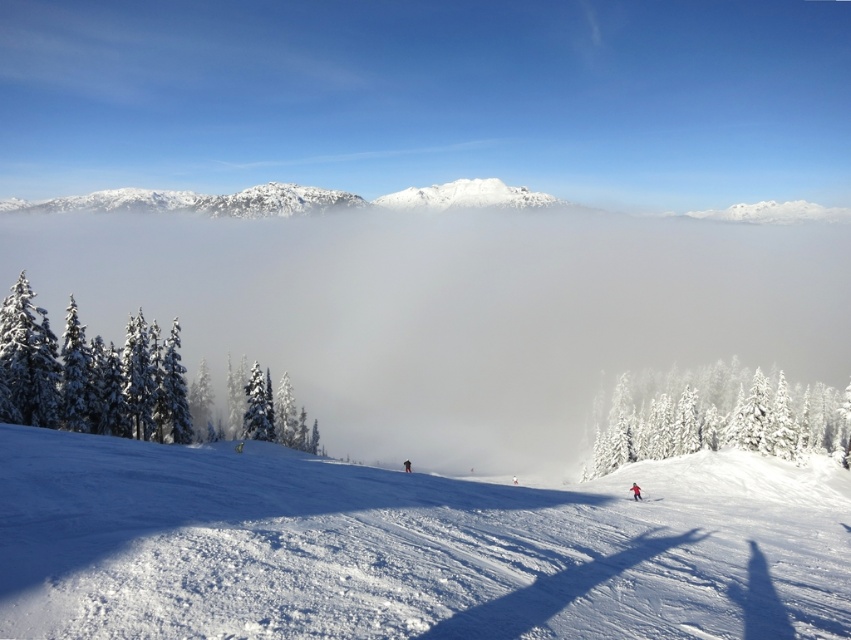
Who is more forward, (370, 228) or (660, 500)?

Point (660, 500) is more forward.

Who is shorter, white fluffy fog at center or red matte ski at lower right?

red matte ski at lower right is shorter.

What do you see at coordinates (448, 301) in the screenshot? I see `white fluffy fog at center` at bounding box center [448, 301].

Image resolution: width=851 pixels, height=640 pixels. I want to click on white fluffy fog at center, so [x=448, y=301].

Is white fluffy fog at center further to the viewer compared to red fabric snowboarder at lower right?

Yes, white fluffy fog at center is further from the viewer.

Can you confirm if white fluffy fog at center is wider than red fabric snowboarder at lower right?

Indeed, white fluffy fog at center has a greater width compared to red fabric snowboarder at lower right.

Is point (550, 360) less distant than point (637, 493)?

No, (550, 360) is further to viewer.

I want to click on white fluffy fog at center, so click(x=448, y=301).

Based on the photo, does white snow ski slope at center lie in front of white snow-covered trees at left?

Yes, white snow ski slope at center is closer to the viewer.

Is white snow ski slope at center smaller than white snow-covered trees at left?

No, white snow ski slope at center is not smaller than white snow-covered trees at left.

Between point (675, 573) and point (13, 385), which one is positioned in front?

Point (675, 573) is in front.

The height and width of the screenshot is (640, 851). I want to click on white snow ski slope at center, so click(386, 552).